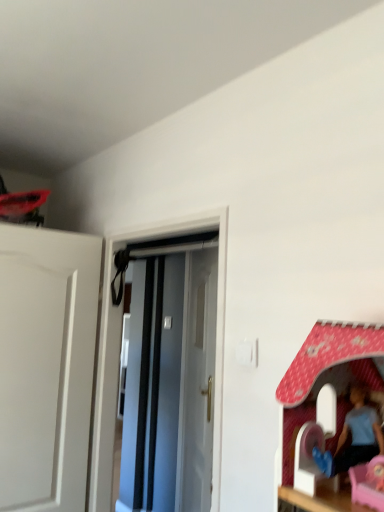
Image resolution: width=384 pixels, height=512 pixels. Identify the location of white glossy door at center, placed as the 1th door when sorted from back to front. (199, 380).

How much space does white glossy door at center, placed as the 1th door when sorted from back to front, occupy horizontally?

white glossy door at center, placed as the 1th door when sorted from back to front, is 4.37 inches wide.

Looking at this image, measure the distance between point [205,401] and camera.

7.87 feet.

What do you see at coordinates (199, 380) in the screenshot? I see `white glossy door at center, placed as the 1th door when sorted from back to front` at bounding box center [199, 380].

What is the approximate width of white glossy door at center, which is the 1th door in front-to-back order?

white glossy door at center, which is the 1th door in front-to-back order, is 5.40 inches in width.

Image resolution: width=384 pixels, height=512 pixels. Describe the element at coordinates (170, 374) in the screenshot. I see `white glossy door at center, marked as the second door in a back-to-front arrangement` at that location.

This screenshot has width=384, height=512. I want to click on white glossy door at center, which is the 1th door in front-to-back order, so click(170, 374).

You are a GUI agent. You are given a task and a screenshot of the screen. Output one action in this format:
    pyautogui.click(x=<x>, y=<y>)
    Task: Click on the white glossy door at center, the 2th door when ordered from front to back
    
    Given the screenshot: What is the action you would take?
    pyautogui.click(x=199, y=380)

Which object is positioned more to the left, white glossy door at center, the 2th door when ordered from front to back, or white glossy door at center, which is the 1th door in front-to-back order?

Positioned to the left is white glossy door at center, which is the 1th door in front-to-back order.

Which object is further away from the camera taking this photo, white glossy door at center, the 2th door when ordered from front to back, or white glossy door at center, marked as the second door in a back-to-front arrangement?

white glossy door at center, the 2th door when ordered from front to back, is more distant.

Is point (195, 494) closer to viewer compared to point (179, 448)?

That is True.

From the image's perspective, who appears lower, white glossy door at center, placed as the 1th door when sorted from back to front, or white glossy door at center, marked as the second door in a back-to-front arrangement?

white glossy door at center, placed as the 1th door when sorted from back to front.

From a real-world perspective, who is located higher, white glossy door at center, the 2th door when ordered from front to back, or white glossy door at center, which is the 1th door in front-to-back order?

From a 3D spatial view, white glossy door at center, which is the 1th door in front-to-back order, is above.

Considering the sizes of white glossy door at center, the 2th door when ordered from front to back, and white glossy door at center, which is the 1th door in front-to-back order, in the image, is white glossy door at center, the 2th door when ordered from front to back, wider or thinner than white glossy door at center, which is the 1th door in front-to-back order,?

In the image, white glossy door at center, the 2th door when ordered from front to back, appears to be more narrow than white glossy door at center, which is the 1th door in front-to-back order.

Who is taller, white glossy door at center, placed as the 1th door when sorted from back to front, or white glossy door at center, marked as the second door in a back-to-front arrangement?

Standing taller between the two is white glossy door at center, placed as the 1th door when sorted from back to front.

Is white glossy door at center, placed as the 1th door when sorted from back to front, bigger than white glossy door at center, which is the 1th door in front-to-back order?

Correct, white glossy door at center, placed as the 1th door when sorted from back to front, is larger in size than white glossy door at center, which is the 1th door in front-to-back order.

Would you say white glossy door at center, placed as the 1th door when sorted from back to front, is outside white glossy door at center, marked as the second door in a back-to-front arrangement?

That's correct, white glossy door at center, placed as the 1th door when sorted from back to front, is outside of white glossy door at center, marked as the second door in a back-to-front arrangement.

Are white glossy door at center, the 2th door when ordered from front to back, and white glossy door at center, marked as the second door in a back-to-front arrangement, beside each other?

white glossy door at center, the 2th door when ordered from front to back, is not next to white glossy door at center, marked as the second door in a back-to-front arrangement, and they're not touching.

Is white glossy door at center, placed as the 1th door when sorted from back to front, looking in the opposite direction of white glossy door at center, marked as the second door in a back-to-front arrangement?

That's not correct — white glossy door at center, placed as the 1th door when sorted from back to front, is not looking away from white glossy door at center, marked as the second door in a back-to-front arrangement.

Measure the distance from white glossy door at center, placed as the 1th door when sorted from back to front, to white glossy door at center, marked as the second door in a back-to-front arrangement.

white glossy door at center, placed as the 1th door when sorted from back to front, is 5.48 inches from white glossy door at center, marked as the second door in a back-to-front arrangement.

Locate an element on the screen. This screenshot has height=512, width=384. door in front of the white glossy door at center, placed as the 1th door when sorted from back to front is located at coordinates point(170,374).

Considering the relative positions of white glossy door at center, marked as the second door in a back-to-front arrangement, and white glossy door at center, the 2th door when ordered from front to back, in the image provided, is white glossy door at center, marked as the second door in a back-to-front arrangement, to the right of white glossy door at center, the 2th door when ordered from front to back, from the viewer's perspective?

No.

Considering the relative positions of white glossy door at center, which is the 1th door in front-to-back order, and white glossy door at center, the 2th door when ordered from front to back, in the image provided, is white glossy door at center, which is the 1th door in front-to-back order, behind white glossy door at center, the 2th door when ordered from front to back,?

No, the depth of white glossy door at center, which is the 1th door in front-to-back order, is less than that of white glossy door at center, the 2th door when ordered from front to back.

Is point (151, 286) in front of point (183, 414)?

No, it is not.

Consider the image. From the image's perspective, who appears lower, white glossy door at center, marked as the second door in a back-to-front arrangement, or white glossy door at center, placed as the 1th door when sorted from back to front?

white glossy door at center, placed as the 1th door when sorted from back to front, appears lower in the image.

From a real-world perspective, is white glossy door at center, marked as the second door in a back-to-front arrangement, physically located above or below white glossy door at center, the 2th door when ordered from front to back?

From a real-world perspective, white glossy door at center, marked as the second door in a back-to-front arrangement, is physically above white glossy door at center, the 2th door when ordered from front to back.

Considering the relative sizes of white glossy door at center, which is the 1th door in front-to-back order, and white glossy door at center, the 2th door when ordered from front to back, in the image provided, is white glossy door at center, which is the 1th door in front-to-back order, wider than white glossy door at center, the 2th door when ordered from front to back,?

Yes, white glossy door at center, which is the 1th door in front-to-back order, is wider than white glossy door at center, the 2th door when ordered from front to back.

Is white glossy door at center, marked as the second door in a back-to-front arrangement, taller than white glossy door at center, placed as the 1th door when sorted from back to front?

Incorrect, the height of white glossy door at center, marked as the second door in a back-to-front arrangement, is not larger of that of white glossy door at center, placed as the 1th door when sorted from back to front.

Is white glossy door at center, which is the 1th door in front-to-back order, bigger or smaller than white glossy door at center, the 2th door when ordered from front to back?

Clearly, white glossy door at center, which is the 1th door in front-to-back order, is smaller in size than white glossy door at center, the 2th door when ordered from front to back.

Would you say white glossy door at center, the 2th door when ordered from front to back, is part of white glossy door at center, which is the 1th door in front-to-back order,'s contents?

Actually, white glossy door at center, the 2th door when ordered from front to back, is outside white glossy door at center, which is the 1th door in front-to-back order.

Looking at this image, is the surface of white glossy door at center, marked as the second door in a back-to-front arrangement, in direct contact with white glossy door at center, the 2th door when ordered from front to back?

white glossy door at center, marked as the second door in a back-to-front arrangement, and white glossy door at center, the 2th door when ordered from front to back, are not in contact.

Could you tell me if white glossy door at center, which is the 1th door in front-to-back order, is facing white glossy door at center, the 2th door when ordered from front to back?

No, white glossy door at center, which is the 1th door in front-to-back order, is not turned towards white glossy door at center, the 2th door when ordered from front to back.

How many degrees apart are the facing directions of white glossy door at center, which is the 1th door in front-to-back order, and white glossy door at center, the 2th door when ordered from front to back?

There is a 28.6-degree angle between the facing directions of white glossy door at center, which is the 1th door in front-to-back order, and white glossy door at center, the 2th door when ordered from front to back.

Identify the location of door that is below the white glossy door at center, which is the 1th door in front-to-back order (from the image's perspective). (199, 380).

In the image, there is a white glossy door at center, the 2th door when ordered from front to back. Identify the location of door above it (from the image's perspective). Image resolution: width=384 pixels, height=512 pixels. (170, 374).

Locate an element on the screen. door located in front of the white glossy door at center, the 2th door when ordered from front to back is located at coordinates (170, 374).